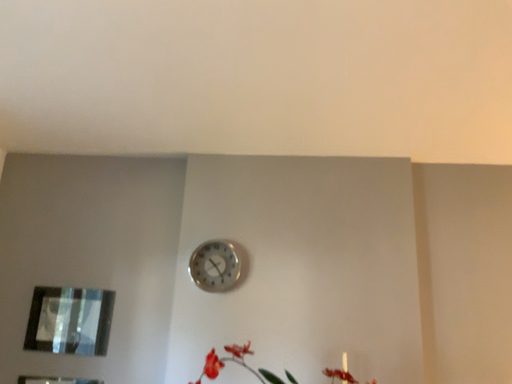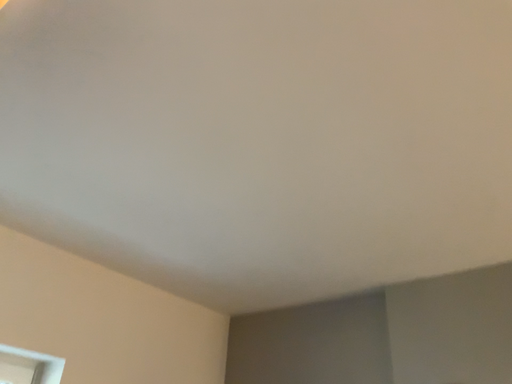
Question: Which way did the camera rotate in the video?

Choices:
 (A) rotated right
 (B) rotated left

Answer: (B)